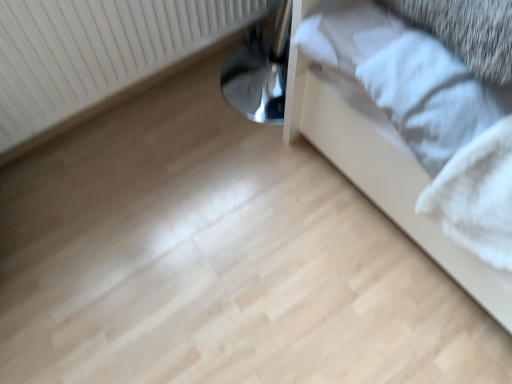
Question: In terms of width, does metallic bed frame at lower right look wider or thinner when compared to white textured radiator at upper left?

Choices:
 (A) wide
 (B) thin

Answer: (A)

Question: Based on their positions, is metallic bed frame at lower right located to the left or right of white textured radiator at upper left?

Choices:
 (A) left
 (B) right

Answer: (B)

Question: Would you say metallic bed frame at lower right is inside or outside white textured radiator at upper left?

Choices:
 (A) outside
 (B) inside

Answer: (A)

Question: Choose the correct answer: Is white textured radiator at upper left inside metallic bed frame at lower right or outside it?

Choices:
 (A) inside
 (B) outside

Answer: (B)

Question: Is white textured radiator at upper left taller or shorter than metallic bed frame at lower right?

Choices:
 (A) short
 (B) tall

Answer: (A)

Question: Relative to metallic bed frame at lower right, is white textured radiator at upper left in front or behind?

Choices:
 (A) behind
 (B) front

Answer: (A)

Question: From a real-world perspective, relative to metallic bed frame at lower right, is white textured radiator at upper left vertically above or below?

Choices:
 (A) above
 (B) below

Answer: (B)